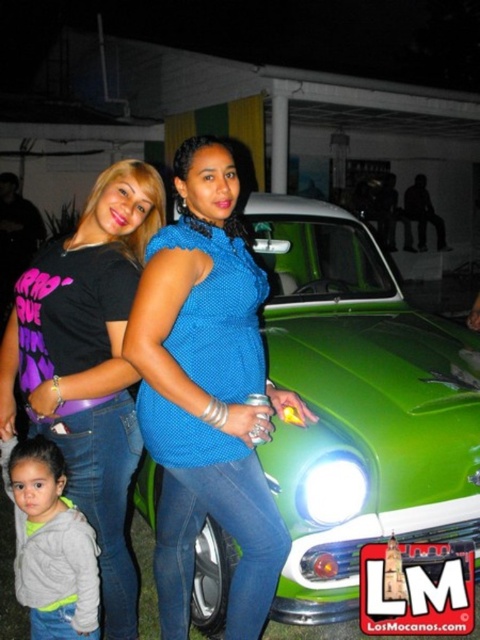
Question: Which point is farther to the camera?

Choices:
 (A) gray fleece jacket at lower left
 (B) blue knitted sweater at center

Answer: (A)

Question: Does green glossy car at center appear on the right side of blue knitted sweater at center?

Choices:
 (A) yes
 (B) no

Answer: (A)

Question: Is green glossy car at center further to the viewer compared to black matte t-shirt at left?

Choices:
 (A) no
 (B) yes

Answer: (B)

Question: Considering the real-world distances, which object is farthest from the gray fleece jacket at lower left?

Choices:
 (A) green glossy car at center
 (B) blue knitted sweater at center
 (C) black matte t-shirt at left

Answer: (A)

Question: Where is green glossy car at center located in relation to gray fleece jacket at lower left in the image?

Choices:
 (A) left
 (B) right

Answer: (B)

Question: Which object appears closest to the camera in this image?

Choices:
 (A) green glossy car at center
 (B) gray fleece jacket at lower left

Answer: (B)